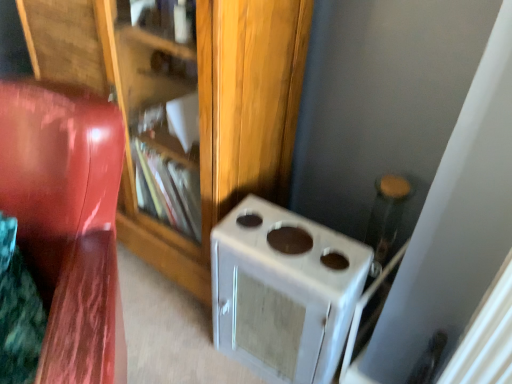
Question: From their relative heights in the image, would you say wooden bookshelf at center is taller or shorter than glossy wood chair at left?

Choices:
 (A) tall
 (B) short

Answer: (A)

Question: Looking at the image, does wooden bookshelf at center seem bigger or smaller compared to glossy wood chair at left?

Choices:
 (A) big
 (B) small

Answer: (A)

Question: Which is nearer to the glossy wood chair at left?

Choices:
 (A) white matte stove at lower right
 (B) wooden bookshelf at center

Answer: (B)

Question: Estimate the real-world distances between objects in this image. Which object is farther from the wooden bookshelf at center?

Choices:
 (A) glossy wood chair at left
 (B) white matte stove at lower right

Answer: (A)